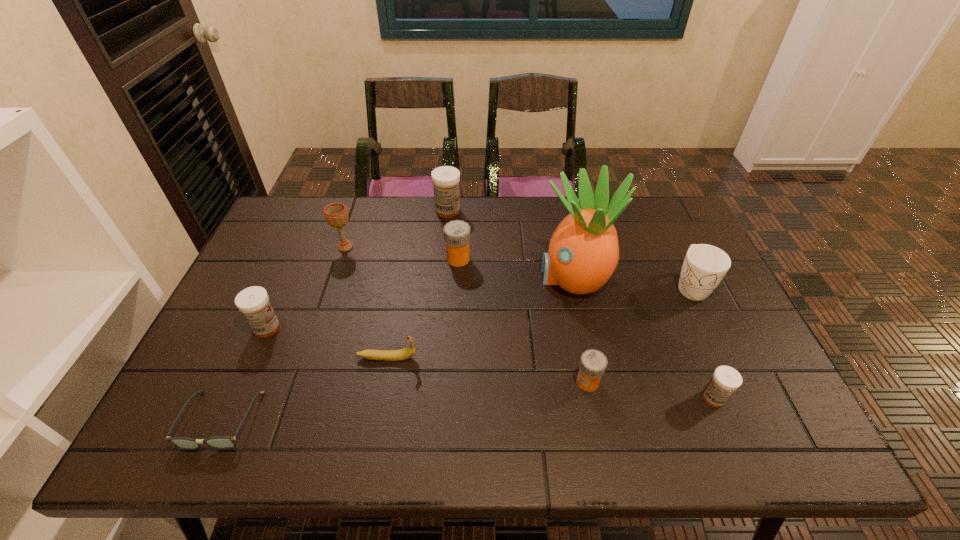
Locate an element on the screen. vacant space situated on the label side of the smaller orange medicine is located at coordinates (538, 382).

Identify the location of vacant space located 0.280m on the left of the rightmost white medicine. (581, 398).

Locate an element on the screen. medicine located at the far edge is located at coordinates click(x=445, y=179).

Find the location of a particular element. This screenshot has width=960, height=540. chalice present at the far edge is located at coordinates (336, 214).

Where is `object positioned at the near edge`? This screenshot has height=540, width=960. object positioned at the near edge is located at coordinates (217, 442).

This screenshot has height=540, width=960. What are the coordinates of `medicine present at the left edge` in the screenshot? It's located at (253, 302).

Find the location of a particular element. The height and width of the screenshot is (540, 960). spectacles that is at the left edge is located at coordinates (217, 442).

Locate an element on the screen. The image size is (960, 540). mug that is at the right edge is located at coordinates (704, 266).

Identify the location of medicine positioned at the right edge. (726, 380).

Locate an element on the screen. Image resolution: width=960 pixels, height=540 pixels. object at the near left corner is located at coordinates (217, 442).